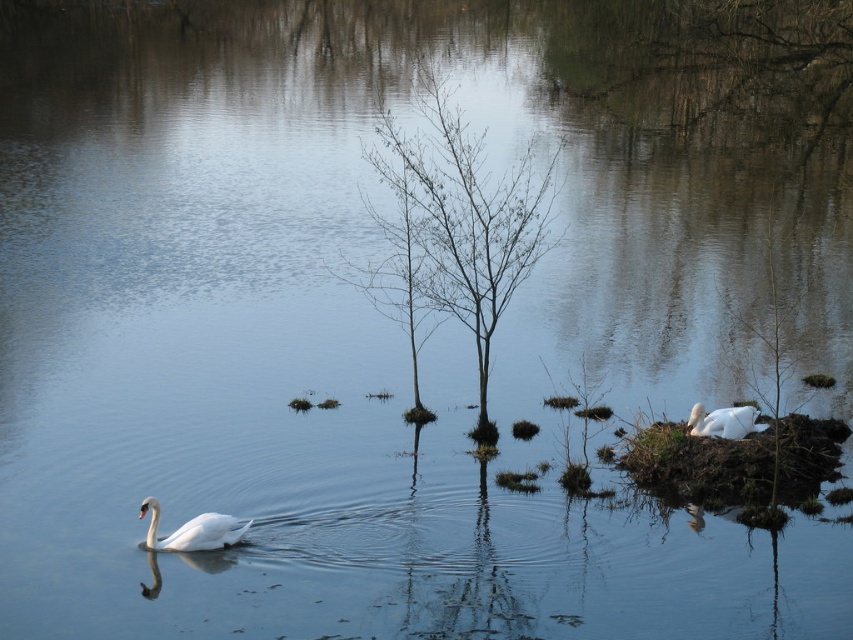
You are a photographer positioned at the center of the lake. You want to capture both the white glossy swan at left and the white matte swan at lower right in a single shot. Which swan would appear lower in the frame?

The white glossy swan at left is located below the white matte swan at lower right, so it would appear lower in the frame.